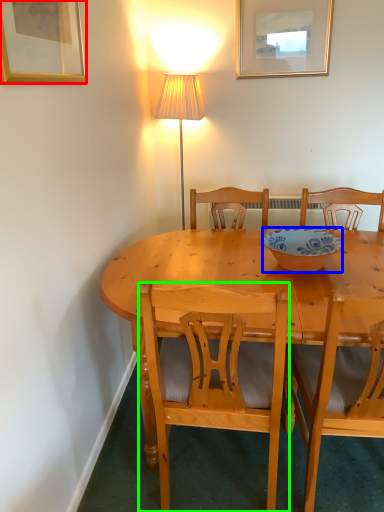
Question: Considering the real-world distances, which object is closest to picture frame (highlighted by a red box)? bowl (highlighted by a blue box) or chair (highlighted by a green box).

Choices:
 (A) bowl
 (B) chair

Answer: (B)